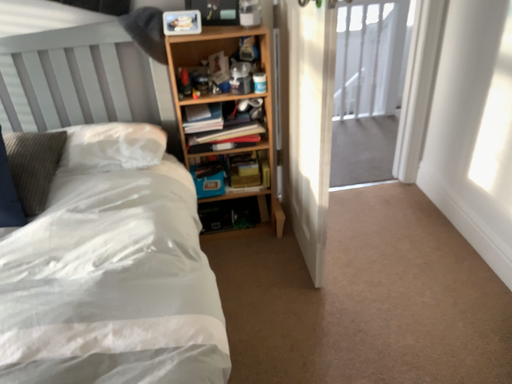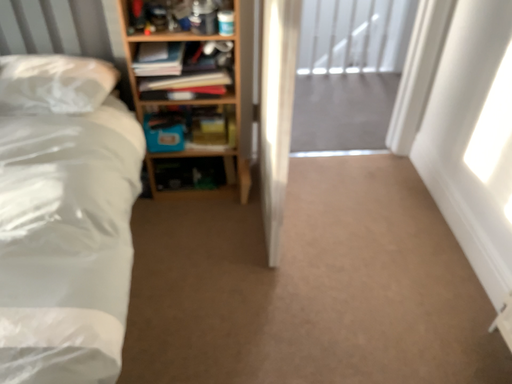
Question: Which way did the camera rotate in the video?

Choices:
 (A) rotated downward
 (B) rotated upward

Answer: (A)